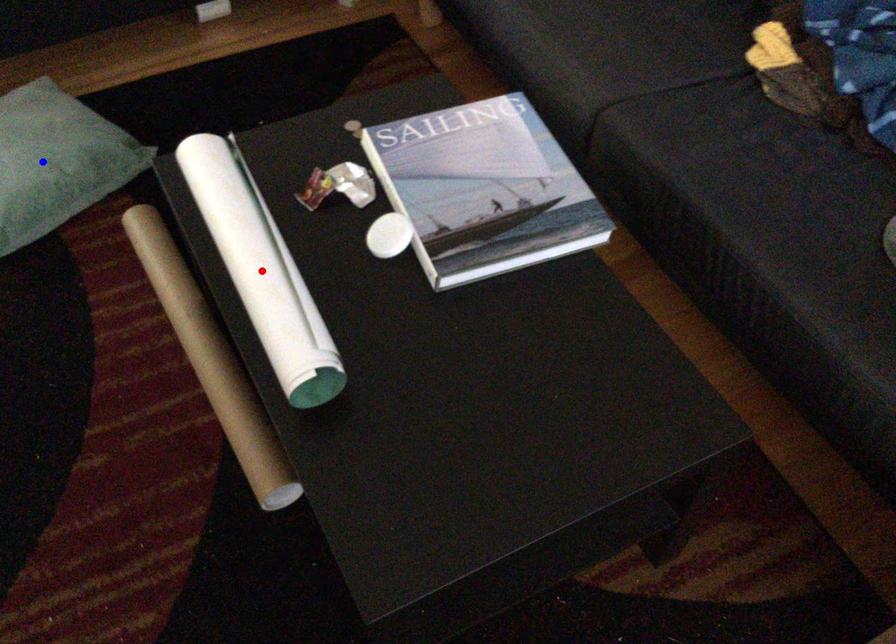
Question: In the image, two points are highlighted. Which point is nearer to the camera? Reply with the corresponding letter.

Choices:
 (A) blue point
 (B) red point

Answer: (B)